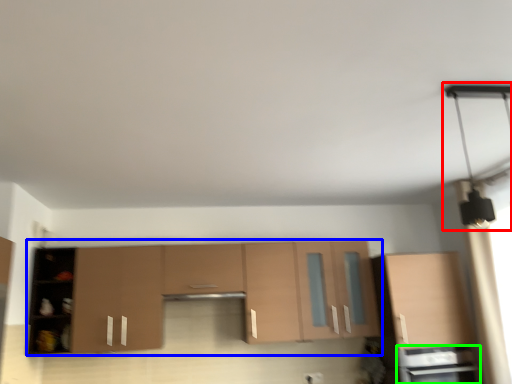
Question: Considering the real-world distances, which object is farthest from light fixture (highlighted by a red box)? cabinetry (highlighted by a blue box) or appliance (highlighted by a green box)?

Choices:
 (A) cabinetry
 (B) appliance

Answer: (A)